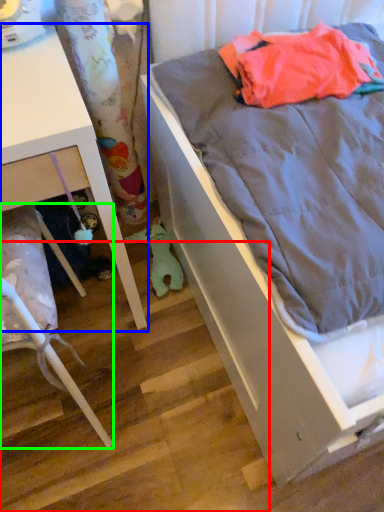
Question: Based on their relative distances, which object is nearer to stair (highlighted by a red box)? Choose from furniture (highlighted by a blue box) and furniture (highlighted by a green box).

Choices:
 (A) furniture
 (B) furniture

Answer: (B)